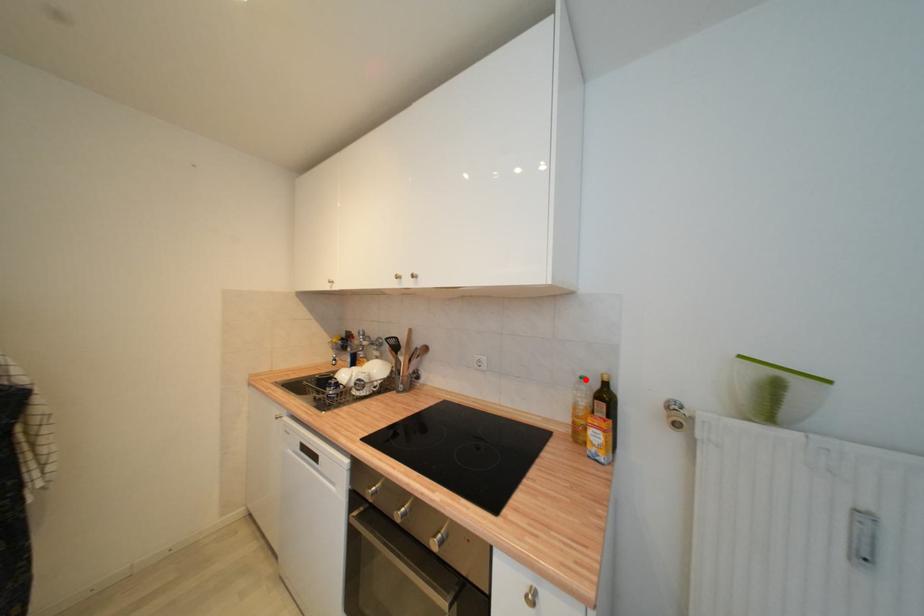
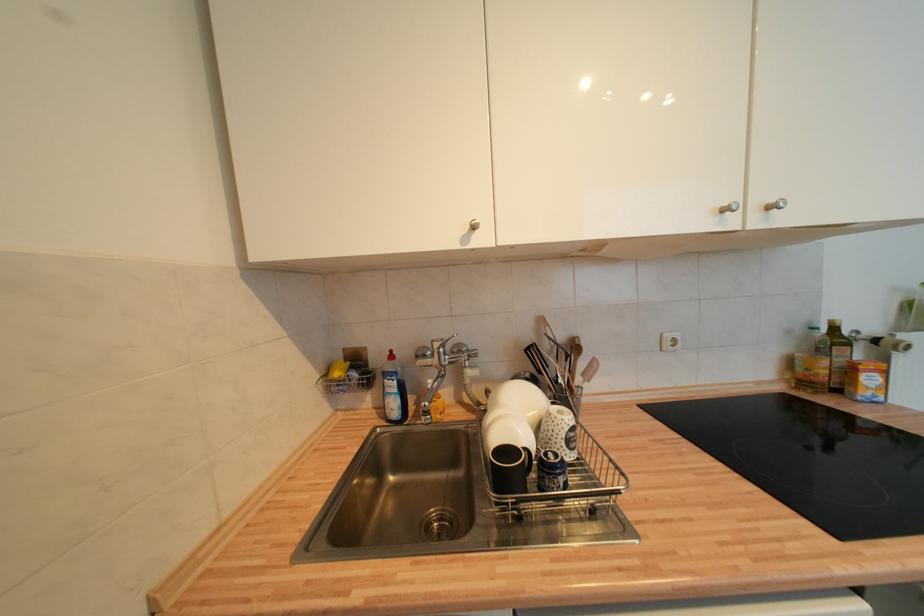
Find the pixel in the second image that matches the highlighted location in the first image.

(819, 331)